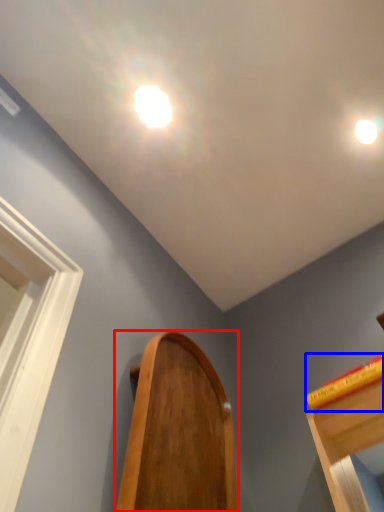
Question: Which point is further to the camera, furniture (highlighted by a red box) or book (highlighted by a blue box)?

Choices:
 (A) furniture
 (B) book

Answer: (B)